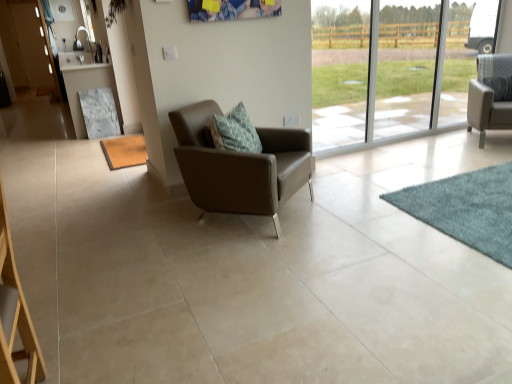
Image resolution: width=512 pixels, height=384 pixels. In order to click on vacant region to the left of matte gray armchair at right, the first chair when ordered from back to front in this screenshot , I will do `click(435, 145)`.